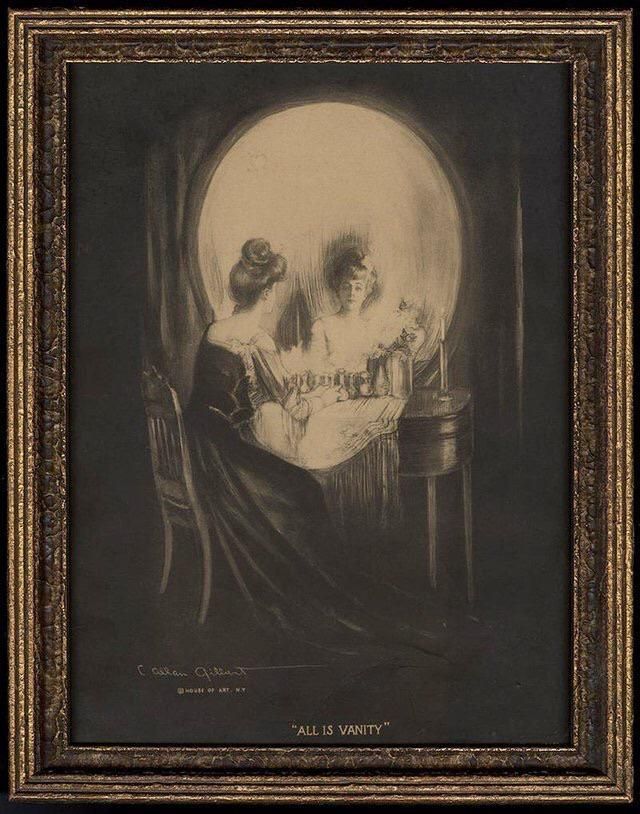
Identify the location of frame. pyautogui.click(x=623, y=768).